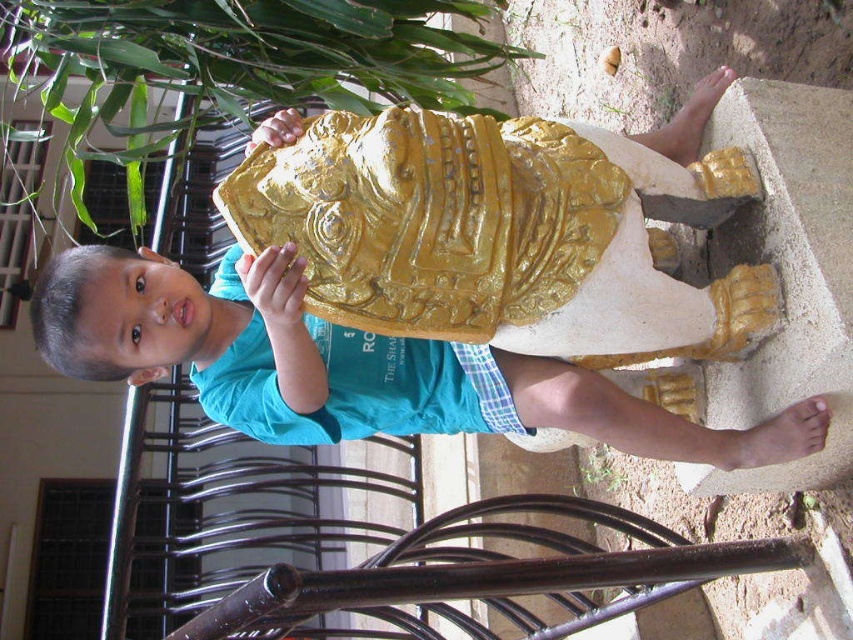
You are a photographer trying to capture the statue and the child in a single shot. You notice two green leafy plants in the scene. Which plant, the green leafy plant at upper left or the green leafy plant at lower center, is wider?

The green leafy plant at upper left is wider than the green leafy plant at lower center because its width surpasses the other.